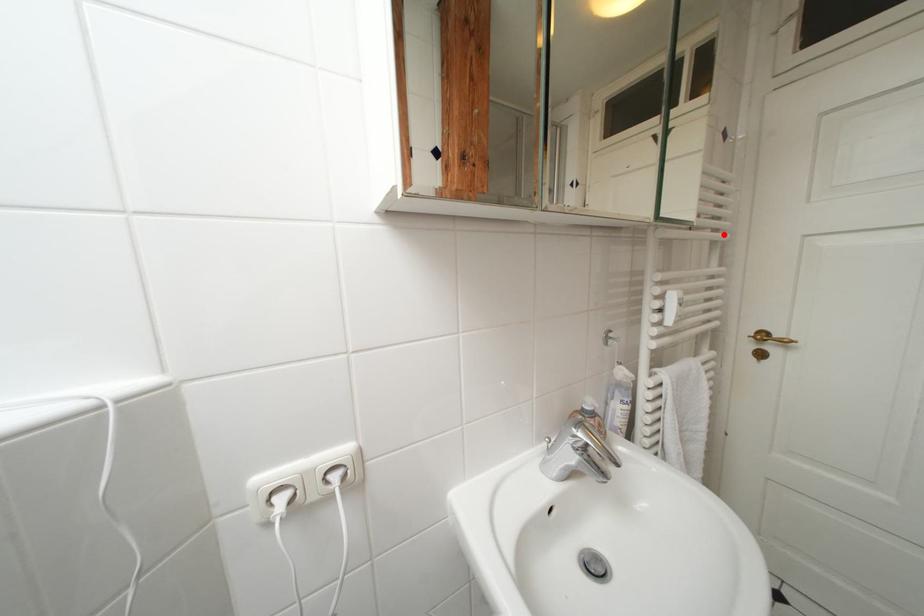
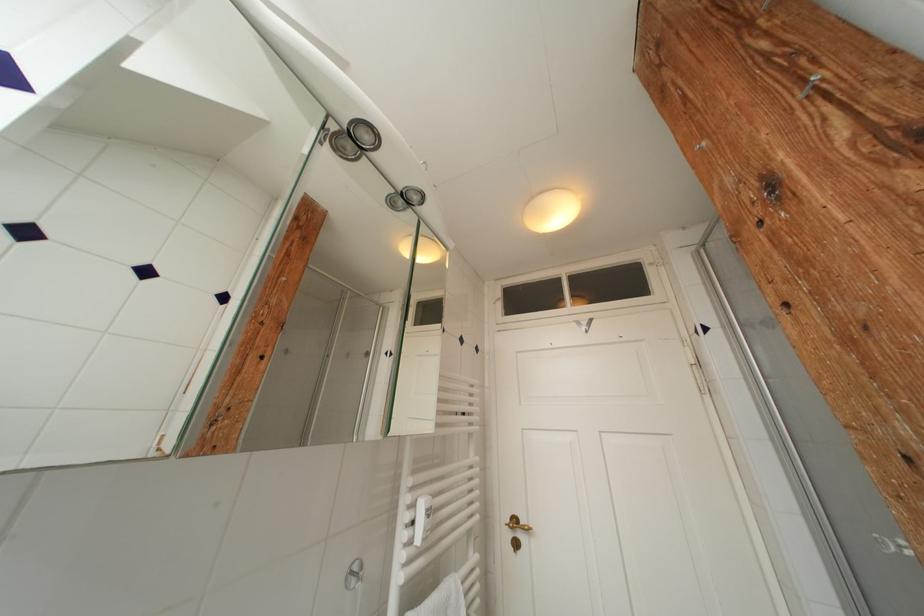
Locate, in the second image, the point that corresponds to the highlighted location in the first image.

(478, 427)